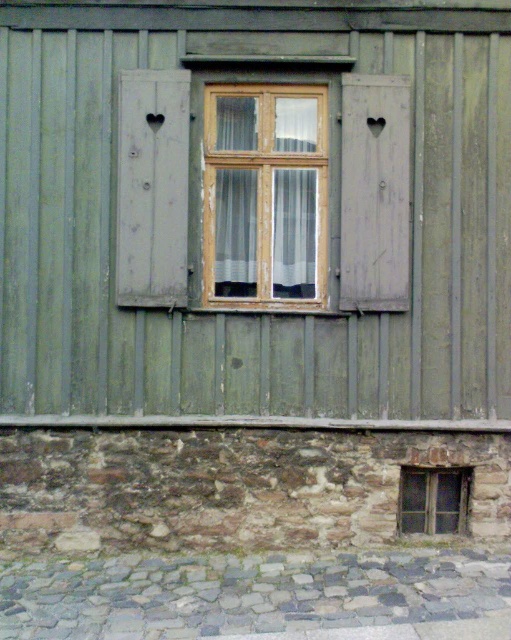
Is wooden window at center behind gray matte wooden shutter at right?

Yes.

Who is positioned more to the left, wooden window at center or gray matte wooden shutter at right?

wooden window at center is more to the left.

Between point (207, 285) and point (406, 202), which one is positioned behind?

The point (207, 285) is behind.

At what (x,y) coordinates should I click in order to perform the action: click on wooden window at center. Please return your answer as a coordinate pair (x, y). Looking at the image, I should click on (265, 195).

How far apart are wooden window at center and wooden heart-shaped shutter at left?

The distance of wooden window at center from wooden heart-shaped shutter at left is 19.41 inches.

Is wooden window at center shorter than wooden heart-shaped shutter at left?

Correct, wooden window at center is not as tall as wooden heart-shaped shutter at left.

Locate an element on the screen. wooden window at center is located at coordinates (265, 195).

Locate an element on the screen. wooden window at center is located at coordinates (265, 195).

Who is taller, wooden window at center or transparent glass window at lower right?

With more height is wooden window at center.

Is point (220, 298) positioned in front of point (452, 525)?

That is True.

You are a GUI agent. You are given a task and a screenshot of the screen. Output one action in this format:
    pyautogui.click(x=<x>, y=<y>)
    Task: Click on the wooden window at center
    This screenshot has height=640, width=511.
    Given the screenshot: What is the action you would take?
    pyautogui.click(x=265, y=195)